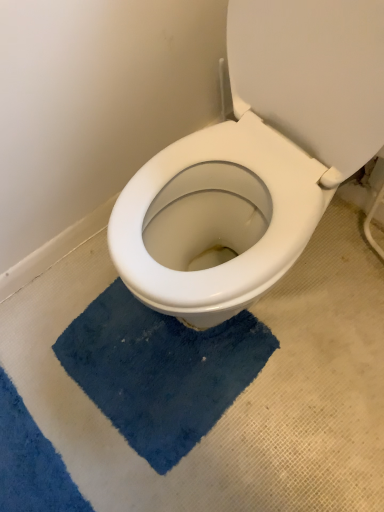
Identify the location of vacant space underneath blue plush bath mat at center (from a real-world perspective). This screenshot has height=512, width=384. (144, 378).